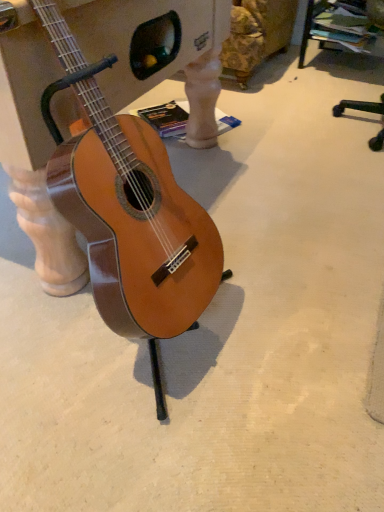
Image resolution: width=384 pixels, height=512 pixels. What are the coordinates of `free space to the left of natural wood guitar at center` in the screenshot? It's located at [x=35, y=322].